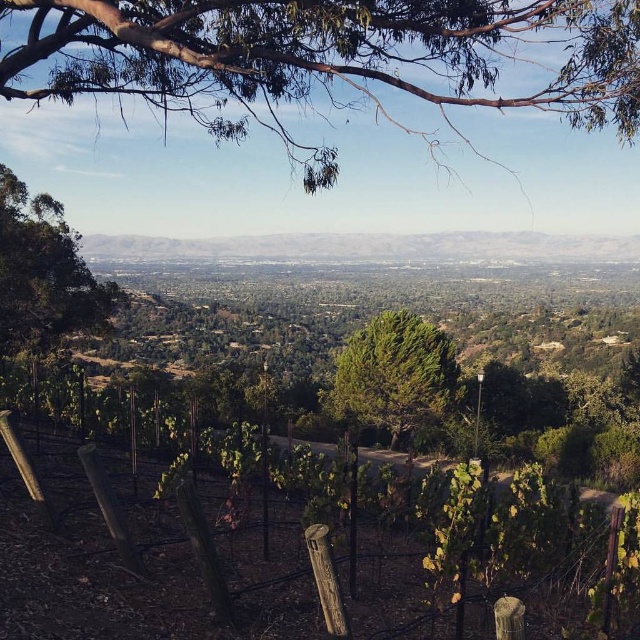
Question: Can you confirm if green leafy branches at upper center is thinner than green textured tree at center?

Choices:
 (A) yes
 (B) no

Answer: (B)

Question: Considering the real-world distances, which object is farthest from the green textured tree at center?

Choices:
 (A) green leafy tree at left
 (B) green leafy branches at upper center

Answer: (A)

Question: Which object is closer to the camera taking this photo?

Choices:
 (A) green textured tree at center
 (B) green leafy branches at upper center

Answer: (B)

Question: Is green leafy branches at upper center to the left of green leafy tree at left from the viewer's perspective?

Choices:
 (A) no
 (B) yes

Answer: (A)

Question: Which of the following is the farthest from the observer?

Choices:
 (A) (230, 35)
 (B) (387, 396)
 (C) (8, 284)

Answer: (B)

Question: Does green leafy branches at upper center lie in front of green textured tree at center?

Choices:
 (A) yes
 (B) no

Answer: (A)